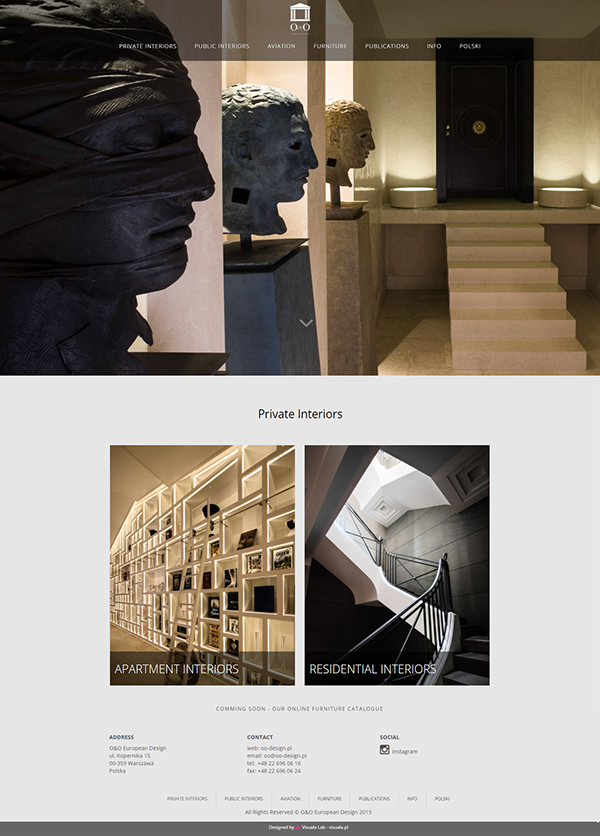
This screenshot has width=600, height=836. What are the coordinates of `black door` in the screenshot? It's located at (478, 95), (473, 177).